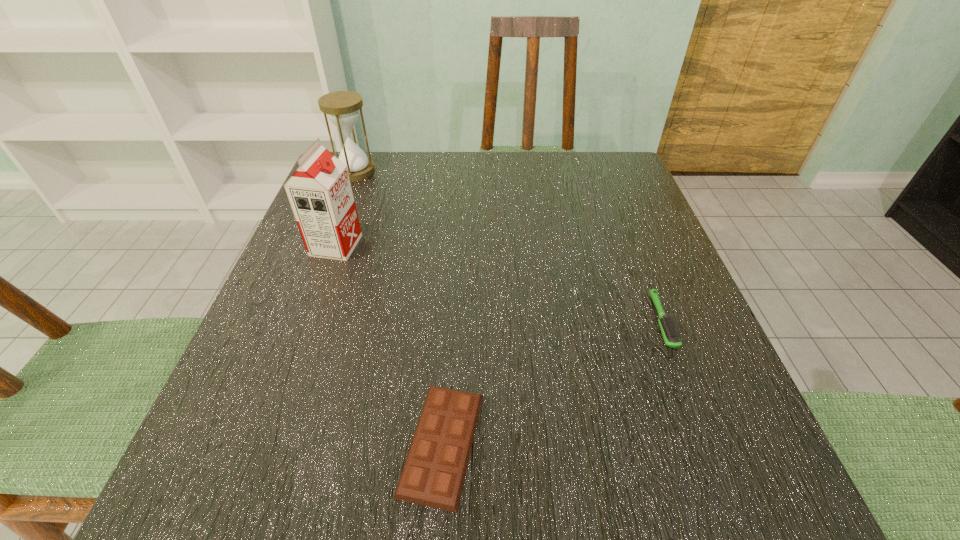
This screenshot has width=960, height=540. What are the coordinates of `the third nearest object` in the screenshot? It's located at (320, 194).

At what (x,y) coordinates should I click in order to perform the action: click on the tallest object. Please return your answer as a coordinate pair (x, y). The image size is (960, 540). Looking at the image, I should click on (320, 194).

Find the location of a particular element. The height and width of the screenshot is (540, 960). the second tallest object is located at coordinates 342,107.

This screenshot has width=960, height=540. What are the coordinates of `the farthest object` in the screenshot? It's located at (342, 107).

What are the coordinates of `the third tallest object` in the screenshot? It's located at (671, 334).

Where is `hairbrush`? hairbrush is located at coordinates pyautogui.click(x=671, y=334).

At what (x,y) coordinates should I click in order to perform the action: click on chocolate bar. Please return your answer as a coordinate pair (x, y). The image size is (960, 540). Looking at the image, I should click on (434, 471).

What are the coordinates of `the shortest object` in the screenshot? It's located at (434, 471).

Where is `vacant space located 0.060m on the front of the soya milk`? vacant space located 0.060m on the front of the soya milk is located at coordinates (323, 284).

Identify the location of vacant space situated 0.300m on the right of the third shortest object. (497, 171).